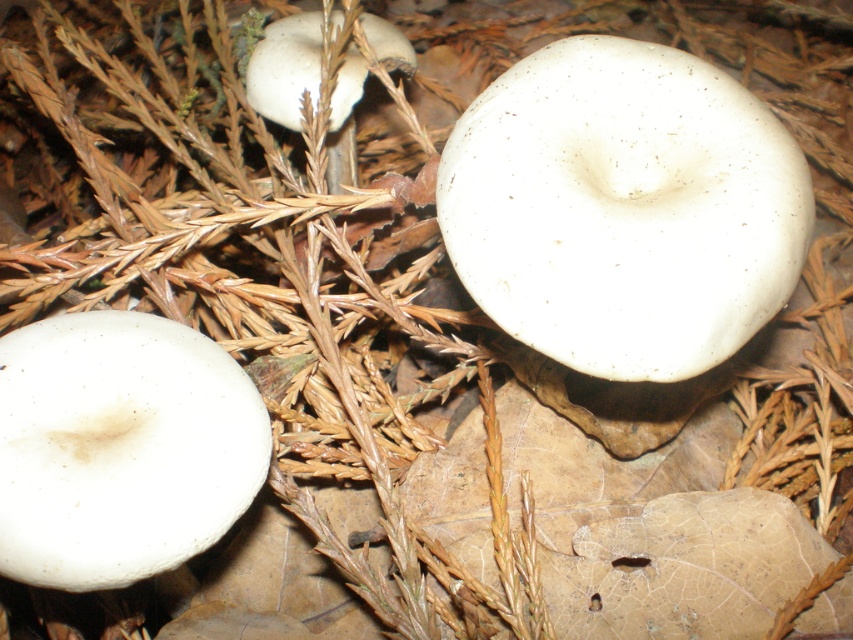
Does white matte mushroom at center have a lesser width compared to white matte mushroom at lower left?

In fact, white matte mushroom at center might be wider than white matte mushroom at lower left.

Can you confirm if white matte mushroom at center is smaller than white matte mushroom at lower left?

Incorrect, white matte mushroom at center is not smaller in size than white matte mushroom at lower left.

Identify the location of white matte mushroom at center. (624, 208).

At what (x,y) coordinates should I click in order to perform the action: click on white matte mushroom at center. Please return your answer as a coordinate pair (x, y). This screenshot has height=640, width=853. Looking at the image, I should click on (624, 208).

Is white matte mushroom at lower left bigger than white matte mushroom at upper center?

No.

The height and width of the screenshot is (640, 853). I want to click on white matte mushroom at lower left, so click(120, 448).

Between point (146, 556) and point (302, 16), which one is positioned behind?

The point (302, 16) is more distant.

At what (x,y) coordinates should I click in order to perform the action: click on white matte mushroom at lower left. Please return your answer as a coordinate pair (x, y). Image resolution: width=853 pixels, height=640 pixels. Looking at the image, I should click on (120, 448).

Who is more distant from viewer, (610,323) or (405,60)?

Positioned behind is point (405,60).

Between white matte mushroom at center and white matte mushroom at upper center, which one has less height?

white matte mushroom at upper center

Measure the distance between point (590, 51) and camera.

They are 1.22 meters apart.

Where is `white matte mushroom at center`? The image size is (853, 640). white matte mushroom at center is located at coordinates (624, 208).